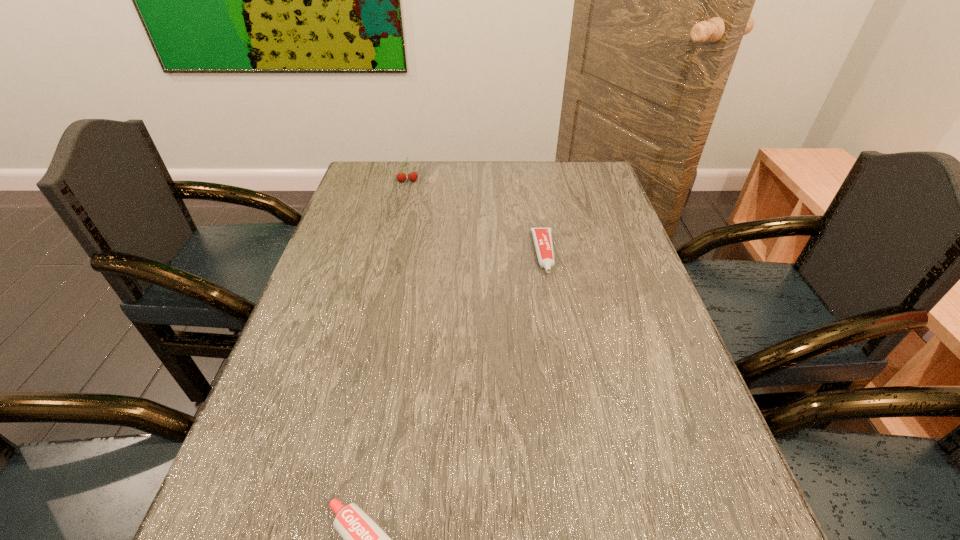
Find the location of `vacant space at the near edge of the desktop`. vacant space at the near edge of the desktop is located at coordinates (601, 532).

The image size is (960, 540). Identify the location of vacant area at the left edge of the desktop. (328, 417).

Where is `free region at the right edge of the desktop`? free region at the right edge of the desktop is located at coordinates (596, 281).

In order to click on vacant area at the far left corner of the desktop in this screenshot , I will do `click(396, 188)`.

Where is `free space at the far right corner of the desktop`? The image size is (960, 540). free space at the far right corner of the desktop is located at coordinates (571, 195).

I want to click on free region at the near right corner of the desktop, so click(x=754, y=531).

The width and height of the screenshot is (960, 540). Find the location of `free space between the right toothpaste and the tallest object`. free space between the right toothpaste and the tallest object is located at coordinates (475, 218).

Find the location of `free point between the farthest object and the second nearest object`. free point between the farthest object and the second nearest object is located at coordinates (475, 218).

Where is `free space that is in between the right toothpaste and the farthest object`? This screenshot has height=540, width=960. free space that is in between the right toothpaste and the farthest object is located at coordinates (475, 218).

This screenshot has height=540, width=960. Find the location of `object that is the second nearest to the farthest object`. object that is the second nearest to the farthest object is located at coordinates (363, 539).